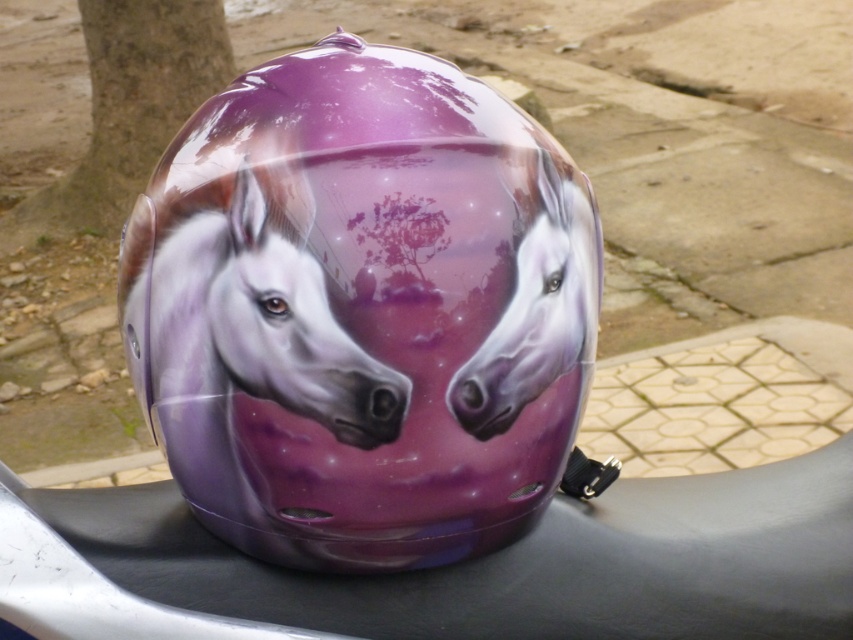
You are a photographer standing 30 inches away from the glossy purple helmet at center. You want to take a clear photo of it. Can you get close enough to focus on the helmet without moving your position?

The glossy purple helmet at center is 26.94 inches away from the viewer. Since you are standing 30 inches away, you are too far to focus. Move closer to within 26.94 inches to capture a clear photo.

You are designing a display stand for the glossy purple helmet at center and the glossy purple horse at center. The stand needs to accommodate both items with enough space between them to avoid touching. What is the minimum distance you should leave between them?

The glossy purple helmet at center is 1.58 inches from the glossy purple horse at center, so the minimum distance between them should be at least 1.58 inches to prevent touching.